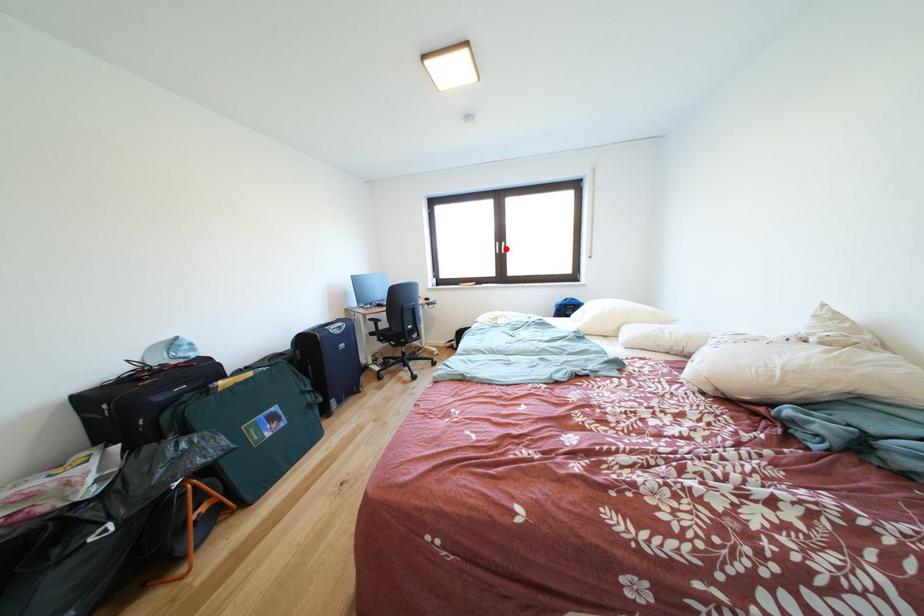
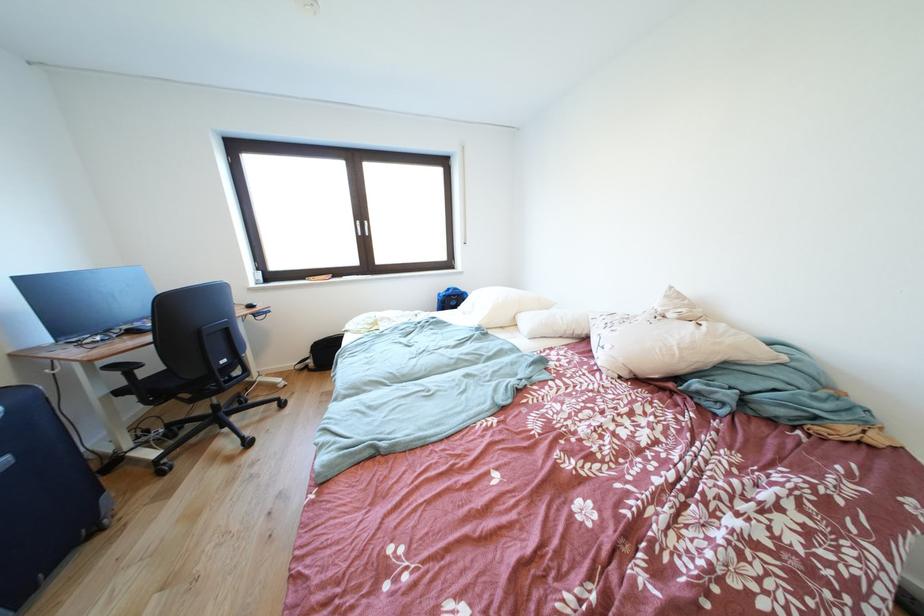
Question: I am providing you with two images of the same scene from different viewpoints. In image1, a red point is highlighted. Considering the same 3D point in image2, which of the following is correct?

Choices:
 (A) It is closer
 (B) It is farther

Answer: (A)